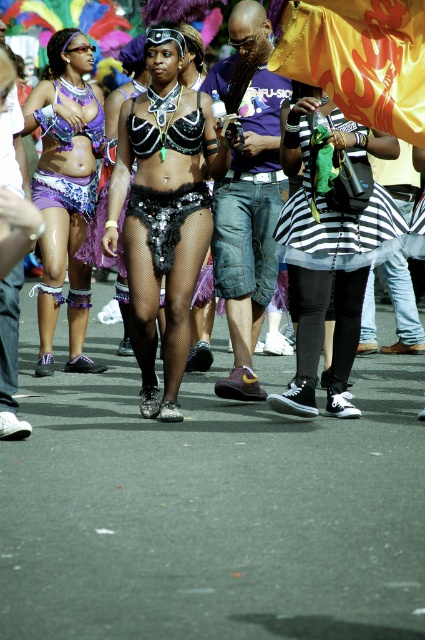
Which is in front, point (136, 13) or point (348, 150)?

Positioned in front is point (348, 150).

Who is shorter, shiny sequined costume at center or black striped skirt at center?

Standing shorter between the two is black striped skirt at center.

Which is behind, point (139, 8) or point (343, 228)?

Point (139, 8)

In order to click on shiny sequined costume at center in this screenshot , I will do `click(102, 24)`.

Between striped fabric skirt at center and shiny sequined costume at center, which one appears on the right side from the viewer's perspective?

Positioned to the right is striped fabric skirt at center.

Is the position of striped fabric skirt at center less distant than that of shiny sequined costume at center?

Yes.

Between point (342, 412) and point (107, 61), which one is positioned in front?

Positioned in front is point (342, 412).

At what (x,y) coordinates should I click in order to perform the action: click on striped fabric skirt at center. Please return your answer as a coordinate pair (x, y). This screenshot has width=425, height=640. Looking at the image, I should click on (329, 244).

Who is shorter, black sequined bikini top at center or striped fabric skirt at center?

striped fabric skirt at center is shorter.

Is black sequined bikini top at center bigger than striped fabric skirt at center?

Actually, black sequined bikini top at center might be smaller than striped fabric skirt at center.

What do you see at coordinates (164, 211) in the screenshot? The image size is (425, 640). I see `black sequined bikini top at center` at bounding box center [164, 211].

Locate an element on the screen. This screenshot has width=425, height=640. black sequined bikini top at center is located at coordinates (164, 211).